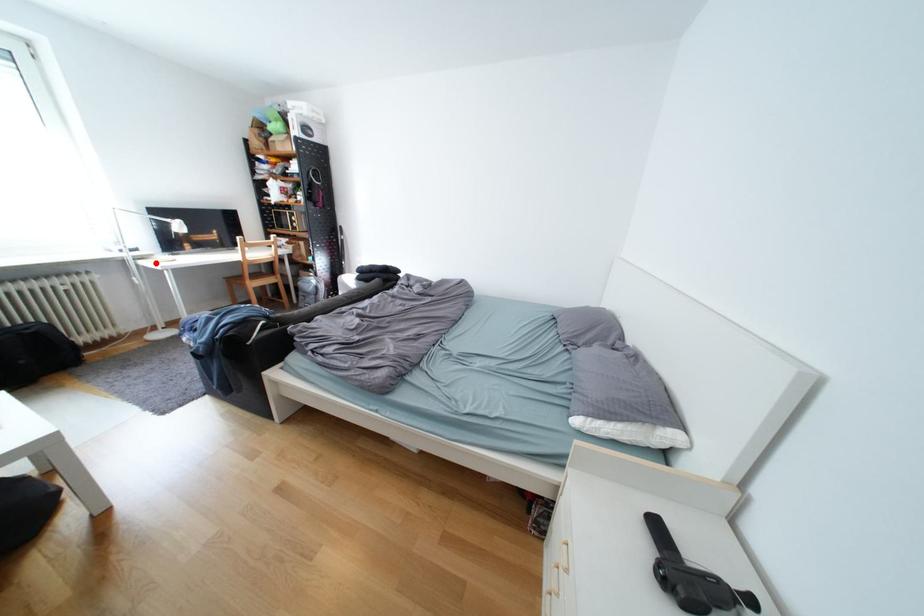
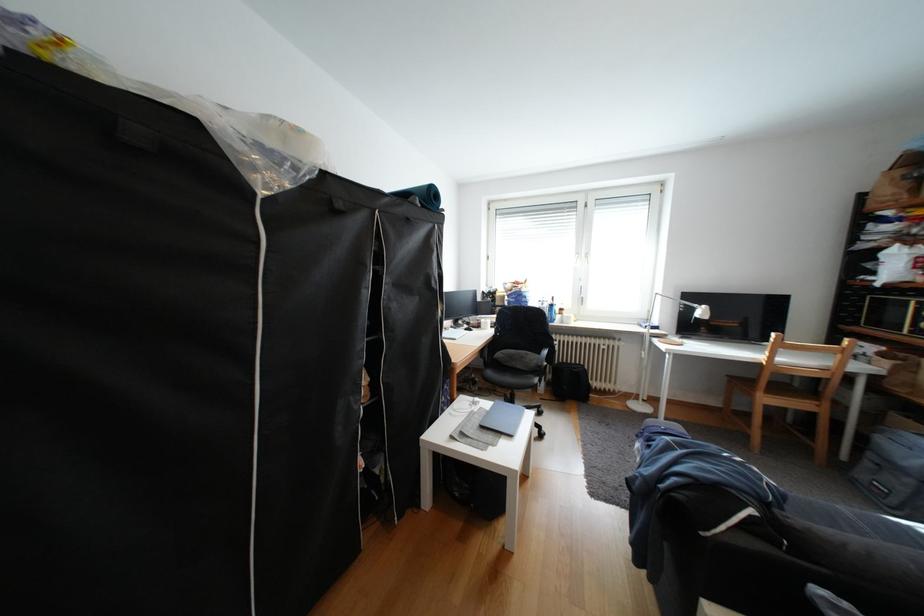
Where in the second image is the point corresponding to the highlighted location from the first image?

(667, 341)